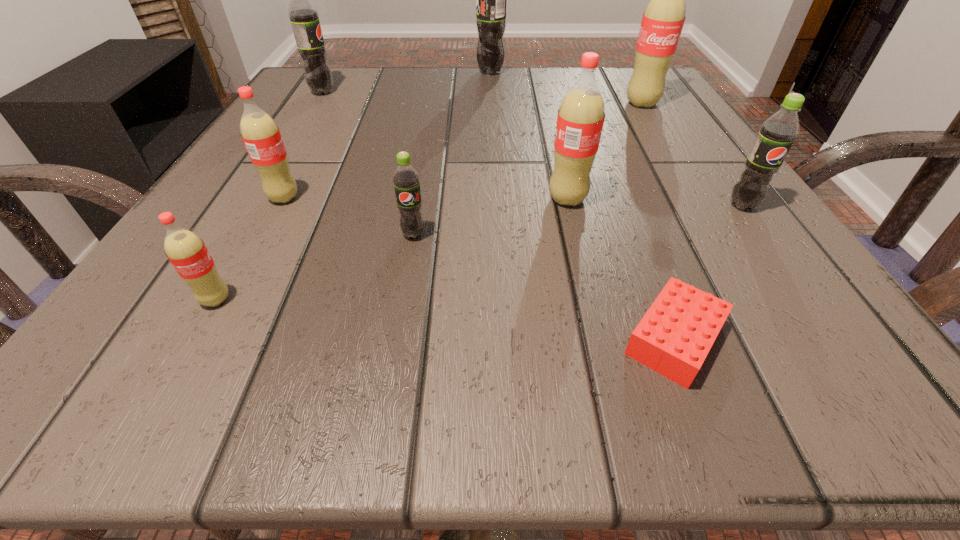
In order to click on vacant region located 0.180m on the back of the third soda from right to left in this screenshot , I will do `click(551, 130)`.

Where is `vacant space positioned on the front label of the third nearest green soda`? The width and height of the screenshot is (960, 540). vacant space positioned on the front label of the third nearest green soda is located at coordinates (466, 92).

Where is `vacant space situated on the right of the third biggest red soda`? vacant space situated on the right of the third biggest red soda is located at coordinates (343, 198).

Identify the location of free space located 0.150m on the front label of the second nearest green soda. This screenshot has width=960, height=540. point(806,296).

Locate an element on the screen. This screenshot has height=540, width=960. vacant space located on the front label of the third green soda from right to left is located at coordinates (399, 323).

Find the location of a particular element. This screenshot has height=540, width=960. free space located 0.090m on the front of the nearest soda is located at coordinates (168, 384).

Where is `vacant space situated 0.390m on the left of the shortest object`? The image size is (960, 540). vacant space situated 0.390m on the left of the shortest object is located at coordinates (239, 339).

At what (x,y) coordinates should I click in order to perform the action: click on object that is at the near edge. Please return your answer as a coordinate pair (x, y). The image size is (960, 540). Looking at the image, I should click on pyautogui.click(x=675, y=335).

Find the location of a particular element. Lego at the right edge is located at coordinates (675, 335).

What are the coordinates of `object at the far left corner` in the screenshot? It's located at (304, 17).